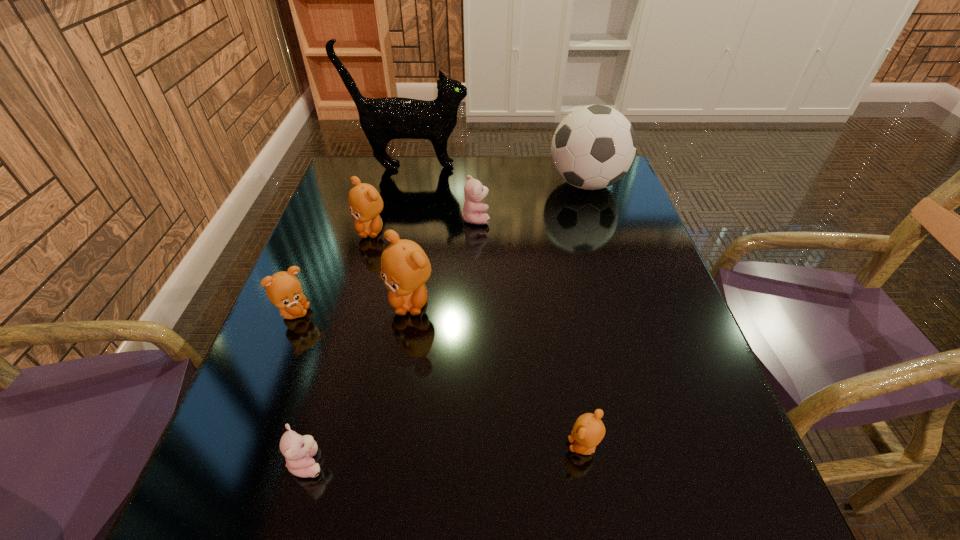
Identify the location of vacant space that's between the cat and the left pink teddy bear. The height and width of the screenshot is (540, 960). (359, 314).

This screenshot has width=960, height=540. I want to click on free spot between the second smallest brown teddy bear and the black cat, so click(352, 240).

At what (x,y) coordinates should I click in order to perform the action: click on vacant area between the farthest brown teddy bear and the second object from right to left. Please return your answer as a coordinate pair (x, y). The height and width of the screenshot is (540, 960). Looking at the image, I should click on (477, 338).

This screenshot has width=960, height=540. I want to click on vacant area that lies between the third tallest object and the second smallest brown teddy bear, so click(352, 307).

Locate an element on the screen. blank region between the rightmost teddy bear and the tallest object is located at coordinates (497, 306).

Find the location of a particular element. The height and width of the screenshot is (540, 960). vacant space in between the second smallest brown teddy bear and the black soccer ball is located at coordinates (440, 248).

Locate an element on the screen. empty space between the third tallest object and the rightmost object is located at coordinates (498, 243).

This screenshot has height=540, width=960. I want to click on object that is the third closest one to the left pink teddy bear, so click(x=588, y=431).

Where is `object that can be found as the fifth closest to the leftmost brown teddy bear`? The image size is (960, 540). object that can be found as the fifth closest to the leftmost brown teddy bear is located at coordinates (382, 119).

Where is `teddy bear identified as the sixth closest to the tallest object`? This screenshot has height=540, width=960. teddy bear identified as the sixth closest to the tallest object is located at coordinates (298, 450).